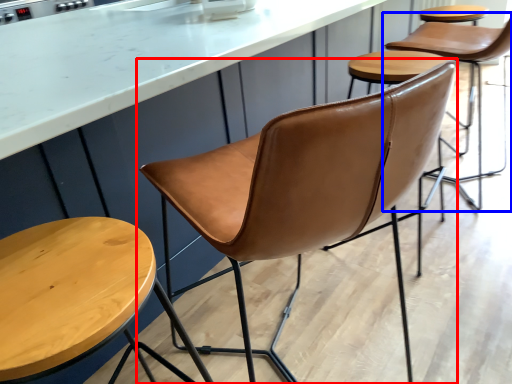
Question: Which object appears farthest to the camera in this image, chair (highlighted by a red box) or chair (highlighted by a blue box)?

Choices:
 (A) chair
 (B) chair

Answer: (B)